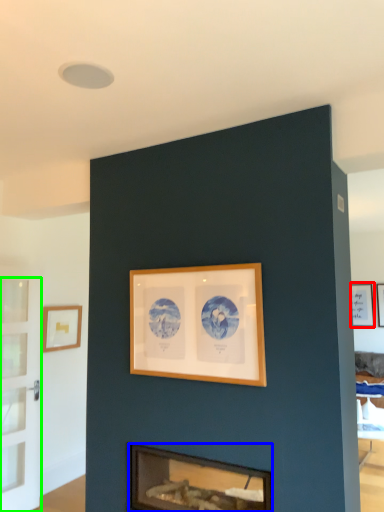
Question: Estimate the real-world distances between objects in this image. Which object is closer to picture frame (highlighted by a red box), fireplace (highlighted by a blue box) or glass door (highlighted by a green box)?

Choices:
 (A) fireplace
 (B) glass door

Answer: (A)